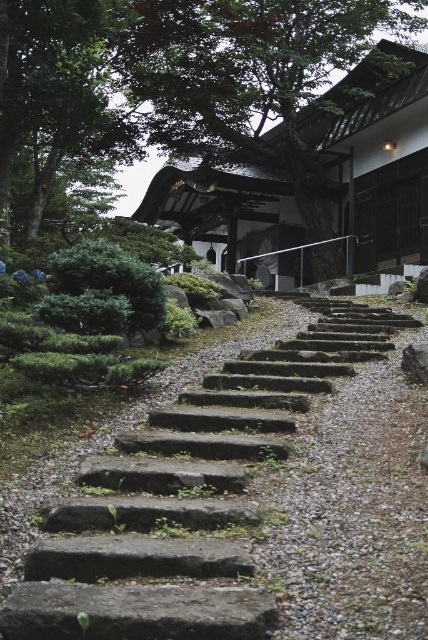
Question: Estimate the real-world distances between objects in this image. Which object is closer to the gray stone at upper center?

Choices:
 (A) green leafy tree at upper center
 (B) green leafy tree at upper left
 (C) gray stone stairs at center

Answer: (C)

Question: Is green leafy tree at upper left thinner than gray stone at upper center?

Choices:
 (A) yes
 (B) no

Answer: (B)

Question: Is gray stone stairs at center positioned in front of green leafy tree at upper left?

Choices:
 (A) no
 (B) yes

Answer: (B)

Question: Which object appears farthest from the camera in this image?

Choices:
 (A) gray stone stairs at center
 (B) green leafy tree at upper left
 (C) green leafy tree at upper center
 (D) gray stone at upper center

Answer: (C)

Question: Is gray stone stairs at center closer to the viewer compared to gray stone at upper center?

Choices:
 (A) yes
 (B) no

Answer: (A)

Question: Which object appears farthest from the camera in this image?

Choices:
 (A) green leafy tree at upper center
 (B) gray stone at upper center

Answer: (A)